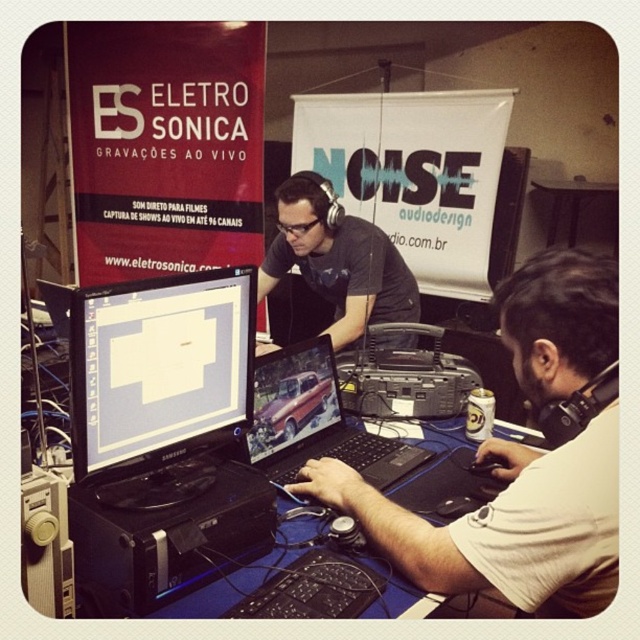
Question: Can you confirm if matte black monitor at center is positioned to the right of black matte headphones at center?

Choices:
 (A) no
 (B) yes

Answer: (A)

Question: Does white matte shirt at lower right have a greater width compared to black matte headphones at center?

Choices:
 (A) yes
 (B) no

Answer: (B)

Question: Does white matte shirt at lower right appear on the left side of metallic silver laptop at center?

Choices:
 (A) no
 (B) yes

Answer: (A)

Question: Which of the following is the farthest from the observer?

Choices:
 (A) matte black monitor at center
 (B) metallic silver laptop at center
 (C) white matte shirt at lower right

Answer: (B)

Question: Among these points, which one is nearest to the camera?

Choices:
 (A) (294, 218)
 (B) (588, 596)

Answer: (B)

Question: Which point is farther from the camera taking this photo?

Choices:
 (A) (346, 461)
 (B) (170, 369)
 (C) (308, 269)
 (D) (602, 582)

Answer: (C)